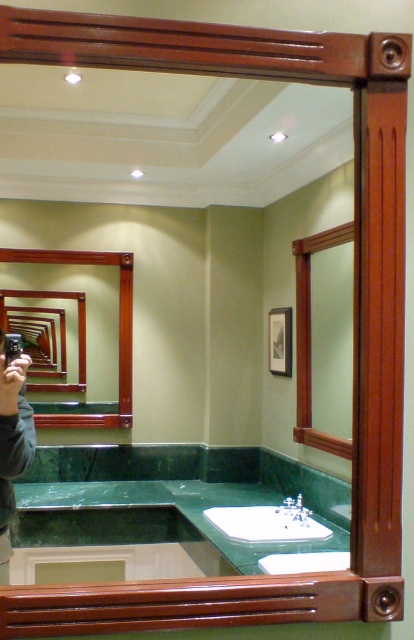
Is green marble mirror at center to the right of white glossy sink at center from the viewer's perspective?

No, green marble mirror at center is not to the right of white glossy sink at center.

Between point (264, 189) and point (289, 502), which one is positioned in front?

Point (289, 502) is more forward.

Locate an element on the screen. green marble mirror at center is located at coordinates (185, 301).